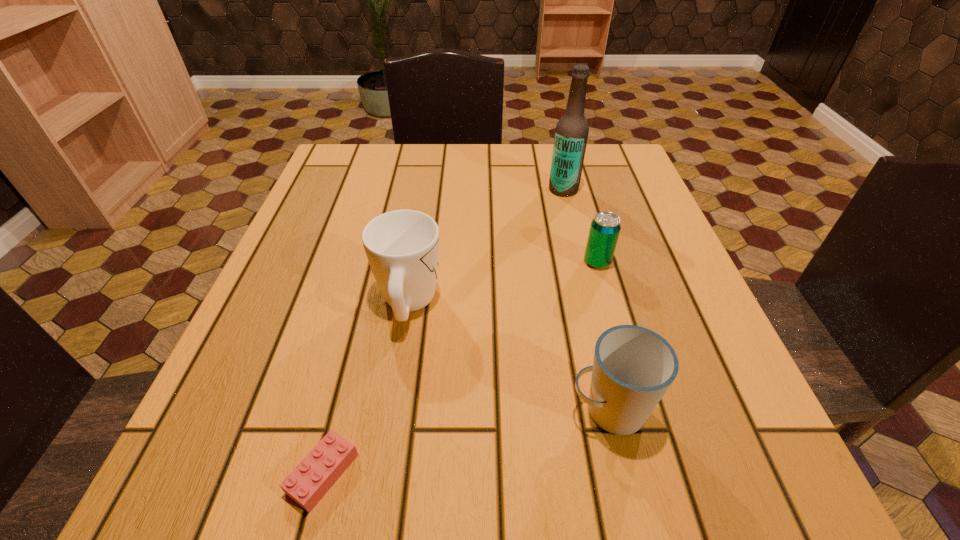
This screenshot has width=960, height=540. Identify the location of empty space between the beer bottle and the third farthest object. (486, 246).

This screenshot has height=540, width=960. Identify the location of free area in between the fourth tallest object and the third nearest object. (503, 282).

The image size is (960, 540). I want to click on vacant space that's between the fourth tallest object and the shortest object, so click(x=460, y=368).

The width and height of the screenshot is (960, 540). I want to click on empty location between the cup and the Lego, so click(466, 442).

Locate an element on the screen. Image resolution: width=960 pixels, height=540 pixels. blank region between the shortest object and the farthest object is located at coordinates click(444, 332).

The height and width of the screenshot is (540, 960). What are the coordinates of `free spot between the mug and the beer bottle` in the screenshot? It's located at (486, 246).

Identify which object is located as the third nearest to the tallest object. Please provide its 2D coordinates. Your answer should be formatted as a tuple, i.e. [(x, y)], where the tuple contains the x and y coordinates of a point satisfying the conditions above.

[(633, 367)]

Point out which object is positioned as the third nearest to the farthest object. Please provide its 2D coordinates. Your answer should be formatted as a tuple, i.e. [(x, y)], where the tuple contains the x and y coordinates of a point satisfying the conditions above.

[(633, 367)]

Where is `vacant area that satisfies the following two spatial constraints: 1. on the label of the tallest object; 2. on the left side of the beer can`? vacant area that satisfies the following two spatial constraints: 1. on the label of the tallest object; 2. on the left side of the beer can is located at coordinates (581, 262).

Image resolution: width=960 pixels, height=540 pixels. I want to click on free location that satisfies the following two spatial constraints: 1. on the side of the mug with the handle; 2. on the right side of the fourth tallest object, so click(416, 262).